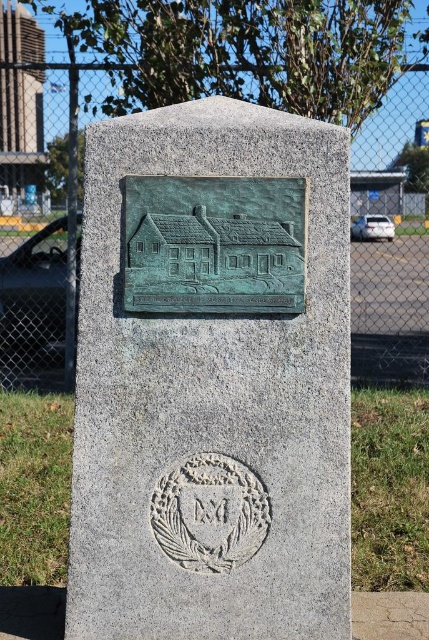
Question: Which point appears farthest from the camera in this image?

Choices:
 (A) (139, 232)
 (B) (337, 602)

Answer: (B)

Question: Which point is closer to the camera?

Choices:
 (A) metal chain-link fence at upper center
 (B) green patina plaque at center
 (C) bronze plaque at center

Answer: (B)

Question: Which object is positioned closest to the metal chain-link fence at upper center?

Choices:
 (A) bronze plaque at center
 (B) green patina plaque at center

Answer: (A)

Question: Where is metal chain-link fence at upper center located in relation to green patina plaque at center in the image?

Choices:
 (A) above
 (B) below

Answer: (A)

Question: In this image, where is bronze plaque at center located relative to metal chain-link fence at upper center?

Choices:
 (A) below
 (B) above

Answer: (A)

Question: Is bronze plaque at center smaller than metal chain-link fence at upper center?

Choices:
 (A) yes
 (B) no

Answer: (A)